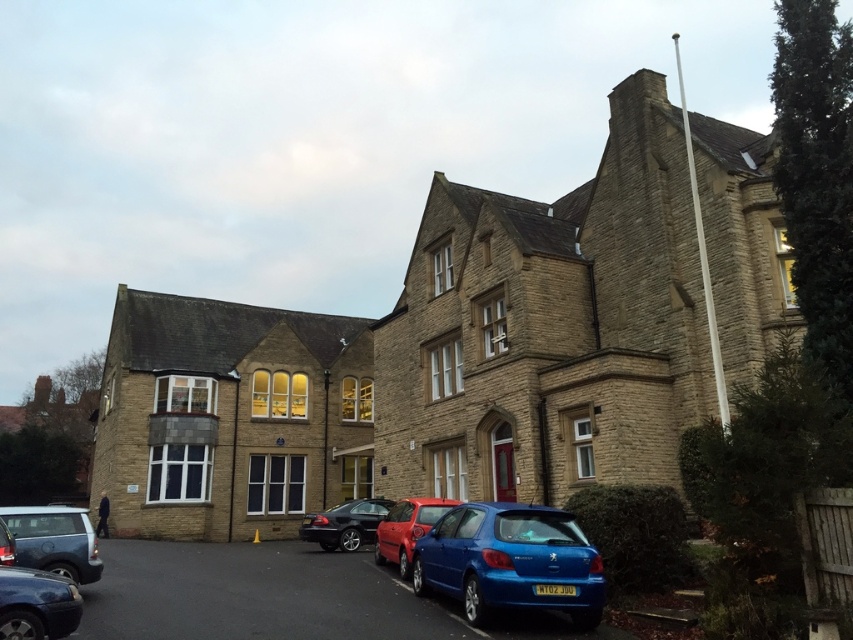
Is matte blue hatchback at lower right taller than matte black car at lower left?

Yes.

Is point (550, 538) positioned in front of point (28, 602)?

No, it is behind (28, 602).

Where is `matte blue hatchback at lower right`? Image resolution: width=853 pixels, height=640 pixels. matte blue hatchback at lower right is located at coordinates (509, 561).

Is matte silver suv at lower left smaller than metallic silver car at lower left?

No, matte silver suv at lower left is not smaller than metallic silver car at lower left.

Is point (21, 560) closer to viewer compared to point (4, 554)?

No, (21, 560) is further to viewer.

This screenshot has width=853, height=640. Identify the location of matte silver suv at lower left. (54, 540).

Is matte silver suv at lower left above satin black car at lower center?

Correct, matte silver suv at lower left is located above satin black car at lower center.

Is matte silver suv at lower left further to the viewer compared to satin black car at lower center?

No, matte silver suv at lower left is closer to the viewer.

You are a GUI agent. You are given a task and a screenshot of the screen. Output one action in this format:
    pyautogui.click(x=<x>, y=<y>)
    Task: Click on the matte silver suv at lower left
    The width and height of the screenshot is (853, 640).
    Given the screenshot: What is the action you would take?
    pyautogui.click(x=54, y=540)

Image resolution: width=853 pixels, height=640 pixels. Identify the location of matte silver suv at lower left. pos(54,540).